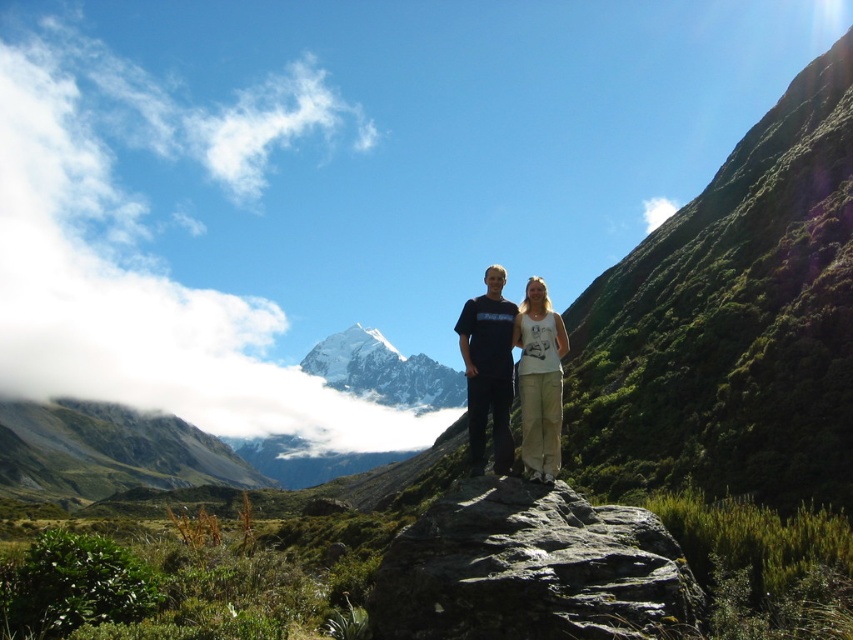
Question: Estimate the real-world distances between objects in this image. Which object is closer to the rocky gray mountain at lower left?

Choices:
 (A) gray rough rock at center
 (B) white fluffy cloud at upper left
 (C) matte black t-shirt at center
 (D) white cotton tank top at center

Answer: (B)

Question: Does gray rough rock at center have a greater width compared to matte black t-shirt at center?

Choices:
 (A) yes
 (B) no

Answer: (A)

Question: Which point is closer to the camera?

Choices:
 (A) (535, 458)
 (B) (374, 173)
 (C) (489, 404)
 (D) (640, 532)

Answer: (D)

Question: Which point is closer to the camera?

Choices:
 (A) white cotton tank top at center
 (B) gray rough rock at center
 (C) matte black t-shirt at center

Answer: (B)

Question: Can you confirm if rocky gray mountain at lower left is positioned above white cotton tank top at center?

Choices:
 (A) no
 (B) yes

Answer: (A)

Question: Is white fluffy cloud at upper left smaller than white cotton tank top at center?

Choices:
 (A) yes
 (B) no

Answer: (B)